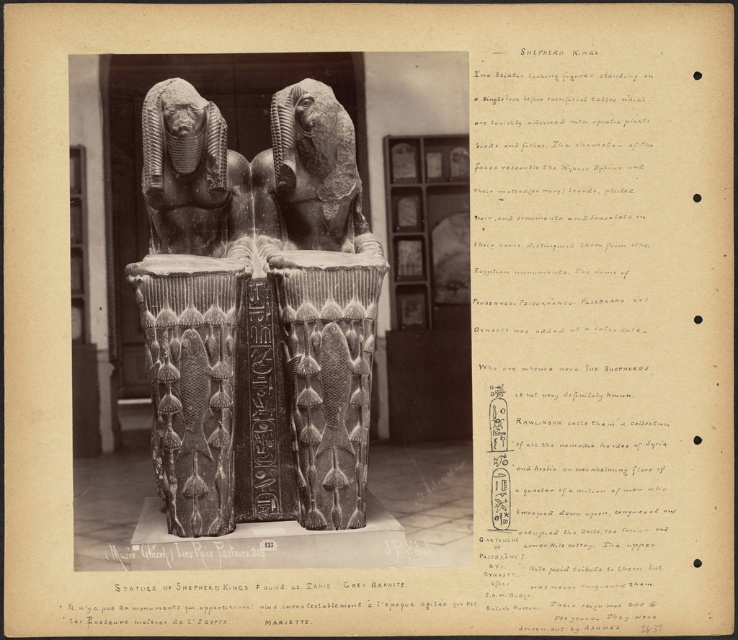
Question: Is gray granite sphinxes at center further to the viewer compared to gray granite statue at center?

Choices:
 (A) no
 (B) yes

Answer: (A)

Question: Which point appears closest to the camera in this image?

Choices:
 (A) [x=303, y=160]
 (B) [x=244, y=252]

Answer: (A)

Question: Which of the following is the farthest from the observer?

Choices:
 (A) (154, 225)
 (B) (348, 218)
 (C) (342, 316)

Answer: (B)

Question: In this image, where is gray granite sphinxes at center located relative to gray granite statue at center?

Choices:
 (A) above
 (B) below

Answer: (B)

Question: Is gray granite sphinxes at center closer to camera compared to dark gray stone sphinx at center?

Choices:
 (A) yes
 (B) no

Answer: (B)

Question: Based on their relative distances, which object is nearer to the dark gray stone sphinx at center?

Choices:
 (A) gray granite sphinxes at center
 (B) gray granite statue at center

Answer: (B)